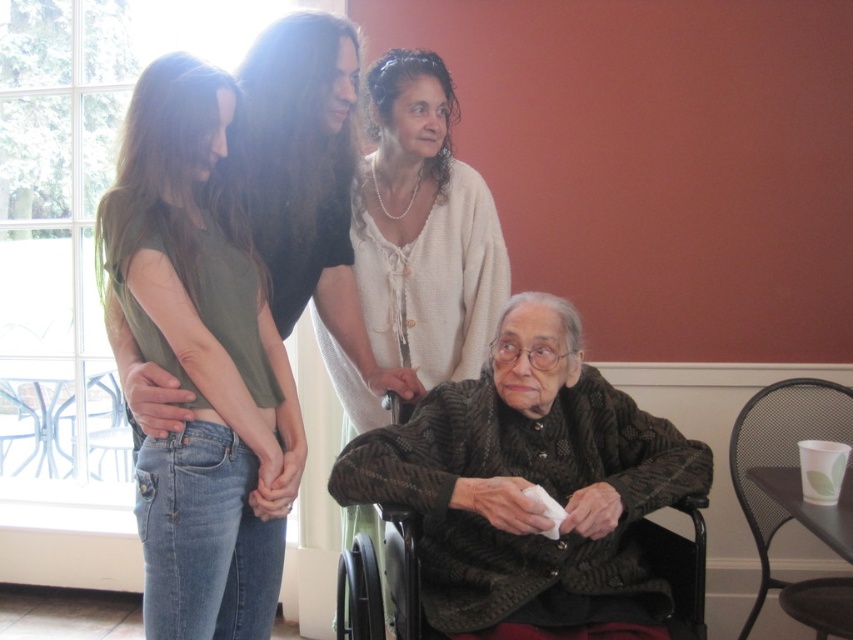
You are a photographer planning to take a group photo of the scene. You need to ensure that the white lace blouse at center and the dark gray fabric wheelchair at lower center are both clearly visible. Based on their sizes, which object should you focus on first to ensure proper exposure?

The white lace blouse at center has a lesser width compared to the dark gray fabric wheelchair at lower center, so you should focus on the dark gray fabric wheelchair at lower center first since it is larger and will require more attention for proper exposure.

You are a photographer setting up a shoot in this scene. You need to place a small prop between the white lace blouse at center and the dark gray fabric wheelchair at lower center. Based on their positions, which side of the wheelchair should the prop be placed on?

The white lace blouse at center is positioned on the right side of the dark gray fabric wheelchair at lower center, so the prop should be placed on the right side of the wheelchair.